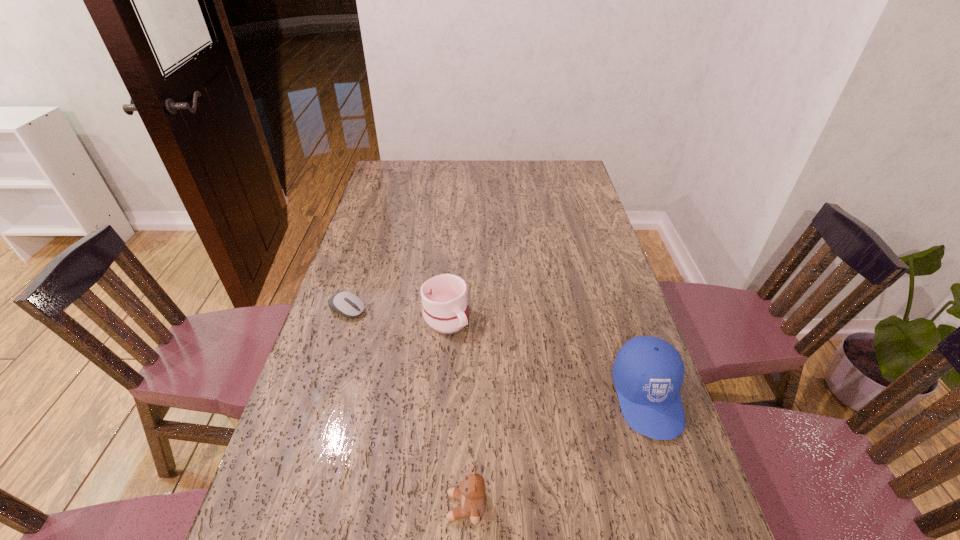
The image size is (960, 540). In order to click on free space between the nearest object and the shortest object in this screenshot , I will do `click(407, 408)`.

This screenshot has width=960, height=540. What are the coordinates of `free space between the shortest object and the teddy bear` in the screenshot? It's located at (407, 408).

Where is `vacant area that lies between the nearest object and the computer equipment`? This screenshot has width=960, height=540. vacant area that lies between the nearest object and the computer equipment is located at coordinates (407, 408).

Where is `object that ranks as the second closest to the mug`? This screenshot has height=540, width=960. object that ranks as the second closest to the mug is located at coordinates (648, 372).

Where is `object that is the closest to the computer equipment`? The image size is (960, 540). object that is the closest to the computer equipment is located at coordinates (444, 297).

Find the location of `vacant space that satisfies the following two spatial constraints: 1. on the front side of the teddy bear; 2. on the front-facing side of the leftmost object`. vacant space that satisfies the following two spatial constraints: 1. on the front side of the teddy bear; 2. on the front-facing side of the leftmost object is located at coordinates (284, 507).

I want to click on vacant position in the image that satisfies the following two spatial constraints: 1. on the front side of the teddy bear; 2. on the front-facing side of the computer equipment, so click(284, 507).

Where is `vacant space that satisfies the following two spatial constraints: 1. on the front side of the mug; 2. on the front-facing side of the nearest object`? This screenshot has width=960, height=540. vacant space that satisfies the following two spatial constraints: 1. on the front side of the mug; 2. on the front-facing side of the nearest object is located at coordinates (430, 507).